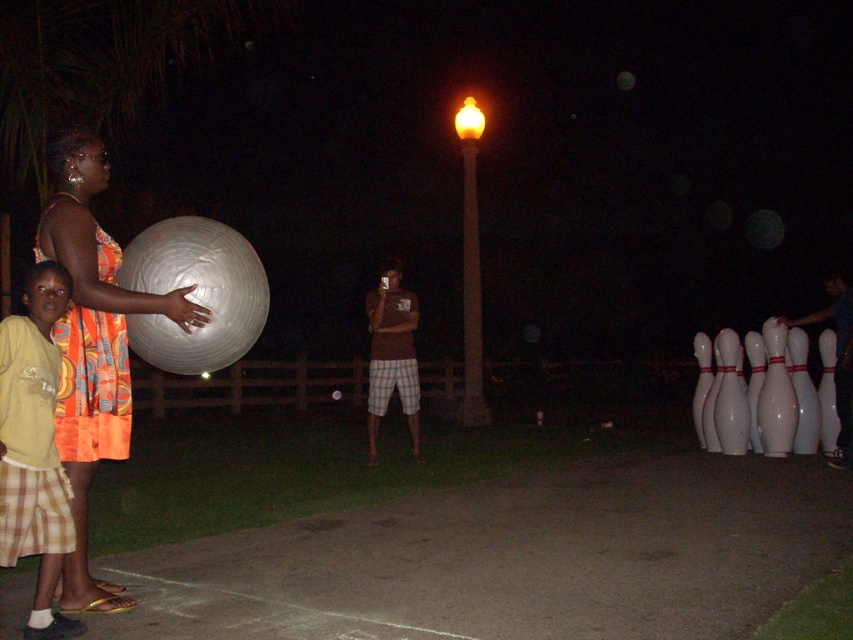
Looking at this image, you are a photographer trying to capture a closeup of the orange printed dress at left and the yellow cotton shirt at left. Since the camera can only focus on one subject at a time, which clothing item should you choose to ensure it fills the frame more?

The orange printed dress at left is larger in size than the yellow cotton shirt at left, so you should focus on the orange printed dress at left to fill the frame more.

You are standing in the nighttime scene and want to hand the yellow cotton shirt at left to a friend who is holding an object. Which object is the friend holding?

The friend is holding a large, reflective silver ball.